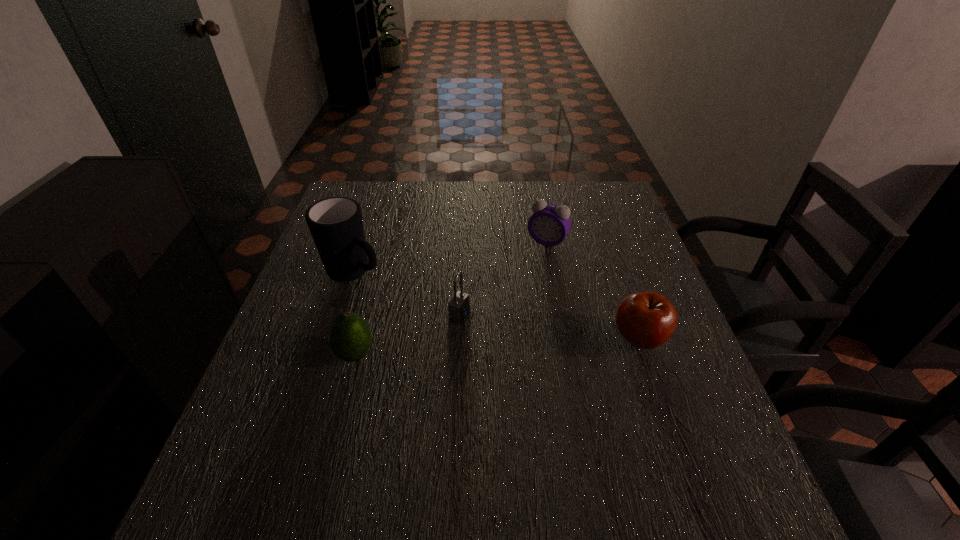
Find the location of a particular element. This screenshot has width=960, height=540. unoccupied area between the avocado and the second object from right to left is located at coordinates (451, 298).

You are a GUI agent. You are given a task and a screenshot of the screen. Output one action in this format:
    pyautogui.click(x=<x>, y=<y>)
    Task: Click on the blank region between the third object from right to left and the avocado
    This screenshot has width=960, height=540.
    Given the screenshot: What is the action you would take?
    pyautogui.click(x=407, y=334)

The height and width of the screenshot is (540, 960). I want to click on free space between the apple and the third object from left to right, so click(x=549, y=327).

The width and height of the screenshot is (960, 540). In order to click on free space between the apple and the avocado in this screenshot , I will do `click(497, 347)`.

Image resolution: width=960 pixels, height=540 pixels. What are the coordinates of `empty location between the second farthest object and the second object from right to left` in the screenshot? It's located at (451, 256).

Find the location of `object that stands as the closest to the mug`. object that stands as the closest to the mug is located at coordinates 350,338.

Identify which object is the fourth closest to the rightmost object. Please provide its 2D coordinates. Your answer should be formatted as a tuple, i.e. [(x, y)], where the tuple contains the x and y coordinates of a point satisfying the conditions above.

[(336, 224)]